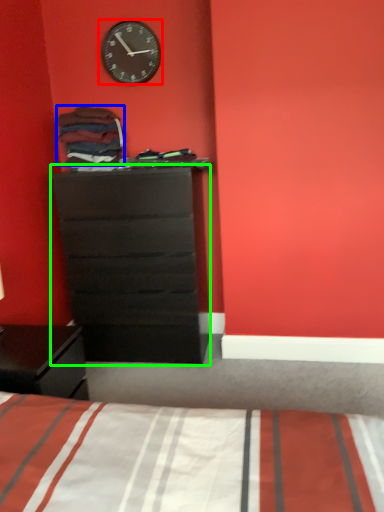
Question: Estimate the real-world distances between objects in this image. Which object is farther from wall clock (highlighted by a red box), clothing (highlighted by a blue box) or chest of drawers (highlighted by a green box)?

Choices:
 (A) clothing
 (B) chest of drawers

Answer: (B)